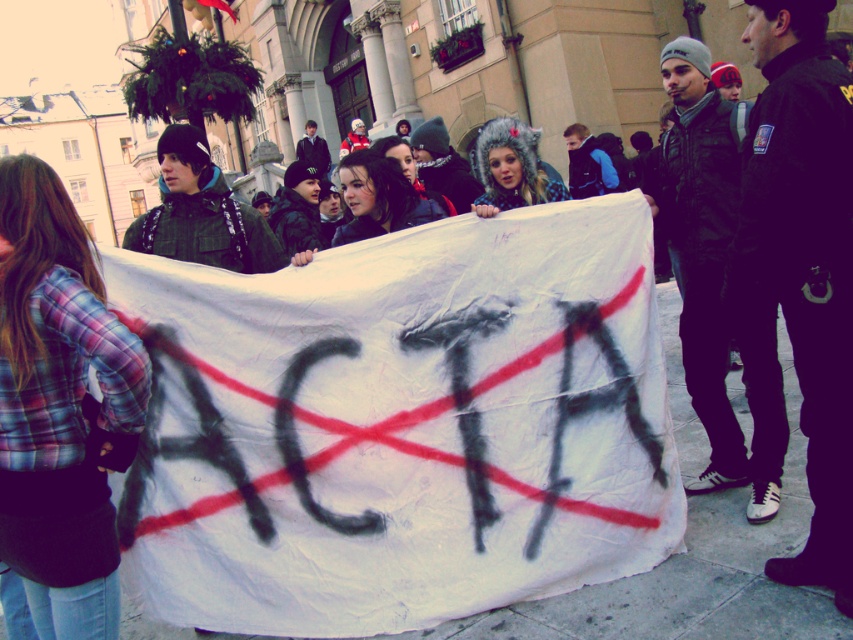
Question: Is plaid fabric shirt at center thinner than fuzzy fur hat at center?

Choices:
 (A) yes
 (B) no

Answer: (A)

Question: Is plaid fabric shirt at center smaller than fuzzy fur hat at center?

Choices:
 (A) yes
 (B) no

Answer: (A)

Question: Among these points, which one is farthest from the camera?

Choices:
 (A) (105, 412)
 (B) (491, 148)
 (C) (393, 204)

Answer: (B)

Question: Considering the real-world distances, which object is farthest from the dark brown hair at center?

Choices:
 (A) plaid fabric shirt at center
 (B) fuzzy fur hat at center

Answer: (A)

Question: Does plaid fabric shirt at center appear over dark brown hair at center?

Choices:
 (A) no
 (B) yes

Answer: (A)

Question: Among these points, which one is nearest to the camera?

Choices:
 (A) pyautogui.click(x=497, y=180)
 (B) pyautogui.click(x=372, y=173)
 (C) pyautogui.click(x=86, y=292)

Answer: (C)